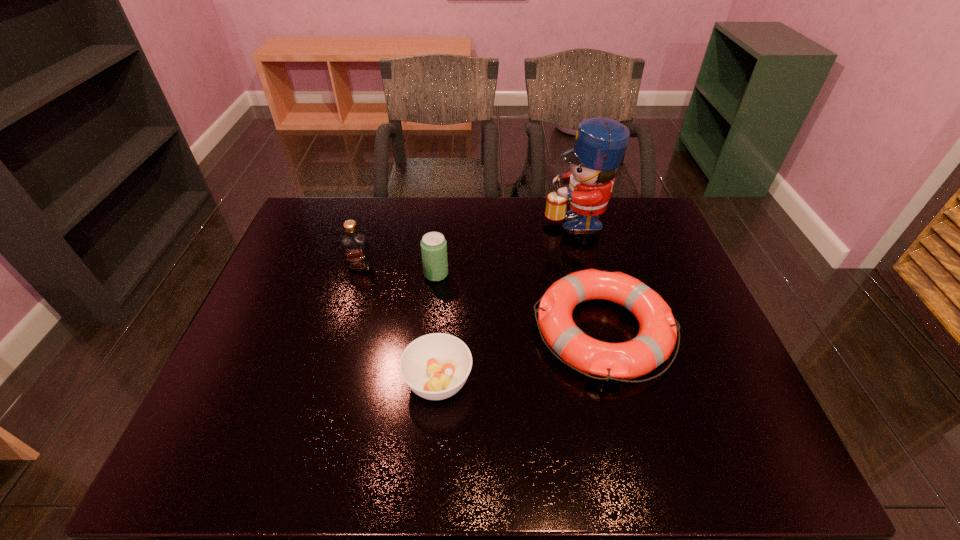
Where is `nutcracker`? Image resolution: width=960 pixels, height=540 pixels. nutcracker is located at coordinates (600, 143).

Identify the location of the farthest object. (600, 143).

Locate an element on the screen. vodka is located at coordinates (355, 247).

The width and height of the screenshot is (960, 540). Find the location of `the second tallest object`. the second tallest object is located at coordinates (355, 247).

The height and width of the screenshot is (540, 960). In order to click on soda in this screenshot , I will do `click(433, 245)`.

Identify the location of life buoy. This screenshot has height=540, width=960. (655, 341).

This screenshot has height=540, width=960. I want to click on soup bowl, so click(435, 366).

I want to click on vacant position located on the front-facing side of the farthest object, so click(x=492, y=218).

Locate an element on the screen. vacant space located on the front-facing side of the farthest object is located at coordinates (457, 218).

Image resolution: width=960 pixels, height=540 pixels. Identify the location of free space located 0.330m on the front-facing side of the farthest object. (444, 218).